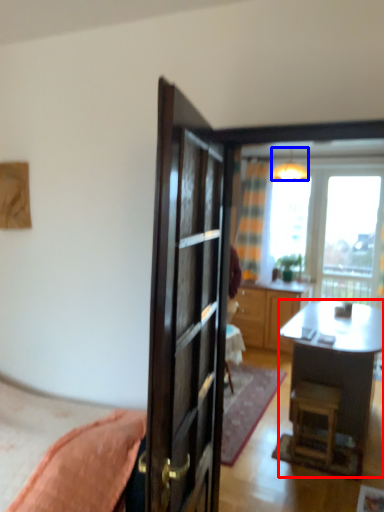
Question: Which of the following is the closest to the observer, desk (highlighted by a red box) or lamp (highlighted by a blue box)?

Choices:
 (A) desk
 (B) lamp

Answer: (A)